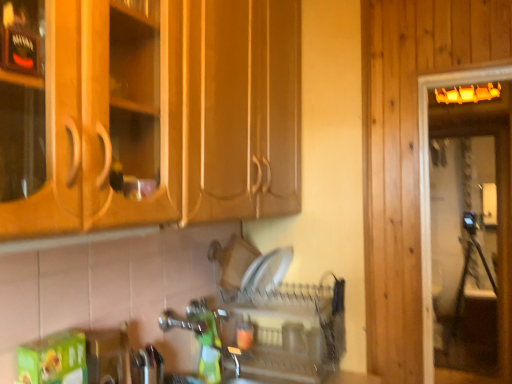
Question: Based on their sizes in the image, would you say clear plastic dish rack at center is bigger or smaller than transparent glass screen door at right?

Choices:
 (A) small
 (B) big

Answer: (A)

Question: From the image's perspective, is clear plastic dish rack at center positioned above or below transparent glass screen door at right?

Choices:
 (A) below
 (B) above

Answer: (A)

Question: Is clear plastic dish rack at center in front of or behind transparent glass screen door at right in the image?

Choices:
 (A) front
 (B) behind

Answer: (A)

Question: Choose the correct answer: Is transparent glass screen door at right inside clear plastic dish rack at center or outside it?

Choices:
 (A) inside
 (B) outside

Answer: (B)

Question: Based on their sizes in the image, would you say transparent glass screen door at right is bigger or smaller than clear plastic dish rack at center?

Choices:
 (A) small
 (B) big

Answer: (B)

Question: Is transparent glass screen door at right in front of or behind clear plastic dish rack at center in the image?

Choices:
 (A) front
 (B) behind

Answer: (B)

Question: Visually, is transparent glass screen door at right positioned to the left or to the right of clear plastic dish rack at center?

Choices:
 (A) right
 (B) left

Answer: (A)